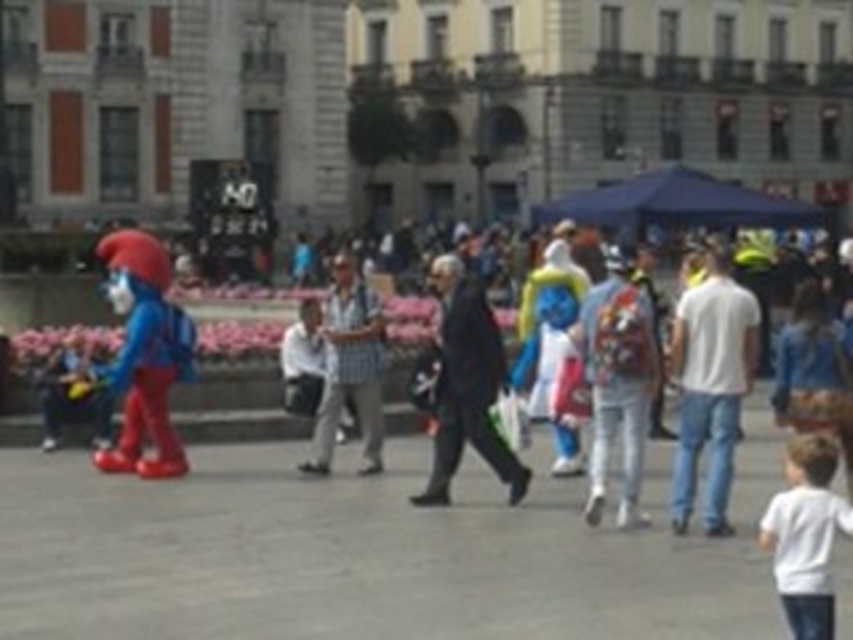
Question: Which object appears closest to the camera in this image?

Choices:
 (A) white matte shirt at lower right
 (B) plush blue costume at left
 (C) checkered fabric shirt at center
 (D) dark suit at center

Answer: (A)

Question: Does white cotton shirt at center-right have a smaller size compared to plush blue costume at left?

Choices:
 (A) yes
 (B) no

Answer: (A)

Question: Is white cotton shirt at center-right below plush blue costume at left?

Choices:
 (A) yes
 (B) no

Answer: (A)

Question: Is plush blue costume at left further to camera compared to checkered fabric shirt at center?

Choices:
 (A) no
 (B) yes

Answer: (A)

Question: Among these points, which one is nearest to the camera?

Choices:
 (A) tap(346, 385)
 (B) tap(178, 316)

Answer: (B)

Question: Which object is farther from the camera taking this photo?

Choices:
 (A) white cotton shirt at center-right
 (B) dark suit at center
 (C) checkered fabric shirt at center
 (D) plush blue costume at left

Answer: (C)